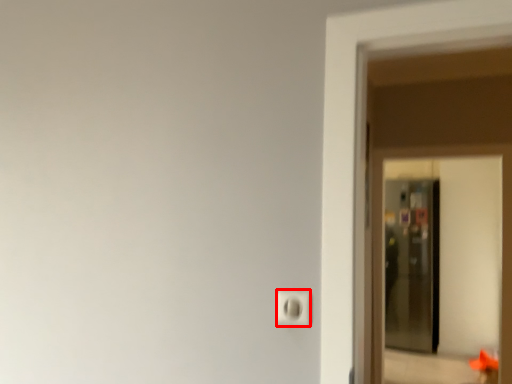
Question: From the image, what is the correct spatial relationship of light switch (annotated by the red box) in relation to screen door?

Choices:
 (A) right
 (B) left

Answer: (B)